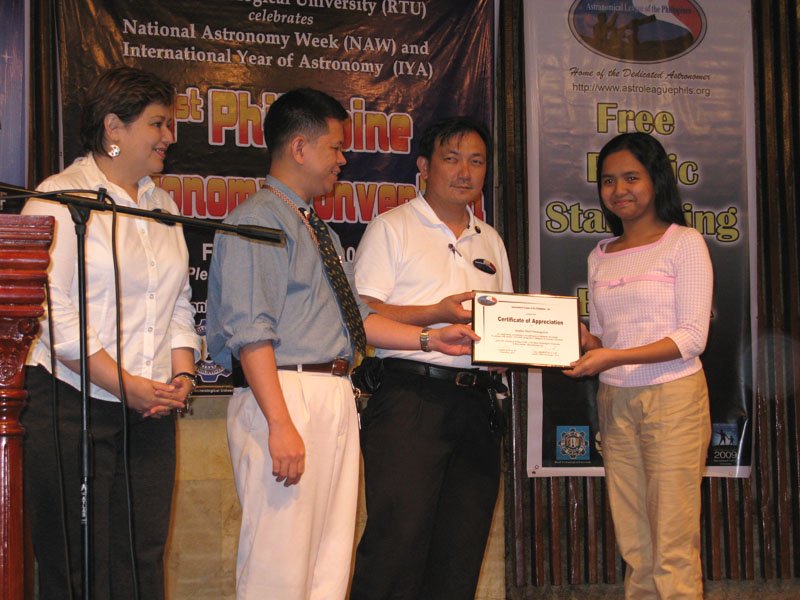
At what (x,y) coordinates should I click in order to perform the action: click on frame. Please return your answer as a coordinate pair (x, y). Looking at the image, I should click on (86, 430).